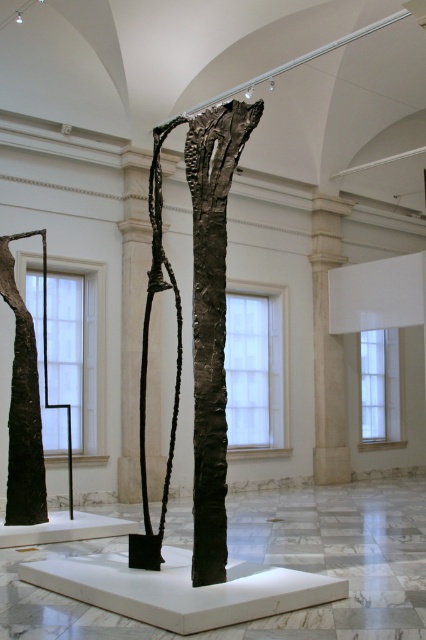
Question: From the image, what is the correct spatial relationship of dark bronze sculpture at center in relation to black textured sculpture at center?

Choices:
 (A) below
 (B) above

Answer: (A)

Question: Which point appears closest to the camera in this image?

Choices:
 (A) (319, 403)
 (B) (209, 355)
 (C) (131, 480)

Answer: (B)

Question: Is light beige stone column at center positioned at the back of black textured tree trunk at left?

Choices:
 (A) yes
 (B) no

Answer: (A)

Question: Which point is closer to the camera?

Choices:
 (A) light beige stone column at center
 (B) black textured tree trunk at left
 (C) black textured sculpture at center
 (D) dark bronze sculpture at center

Answer: (D)

Question: Does black textured sculpture at center lie behind black textured tree trunk at left?

Choices:
 (A) yes
 (B) no

Answer: (A)

Question: Which of the following is the closest to the observer?

Choices:
 (A) (161, 182)
 (B) (146, 164)

Answer: (A)